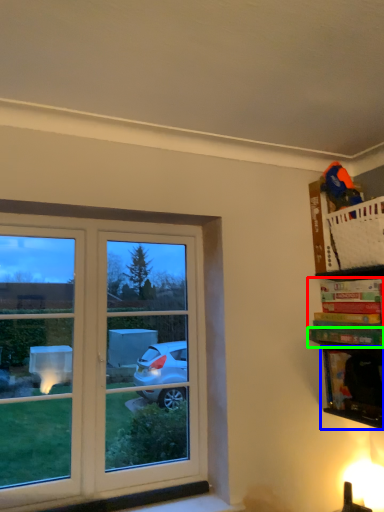
Question: Which object is positioned closest to book (highlighted by a red box)? Select from cabinet (highlighted by a blue box) and book (highlighted by a green box).

Choices:
 (A) cabinet
 (B) book

Answer: (B)